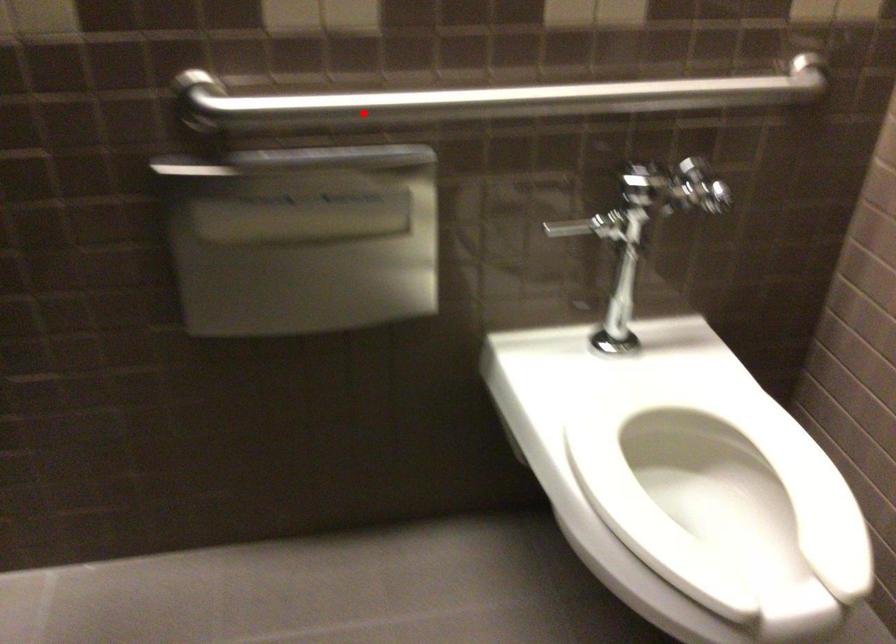
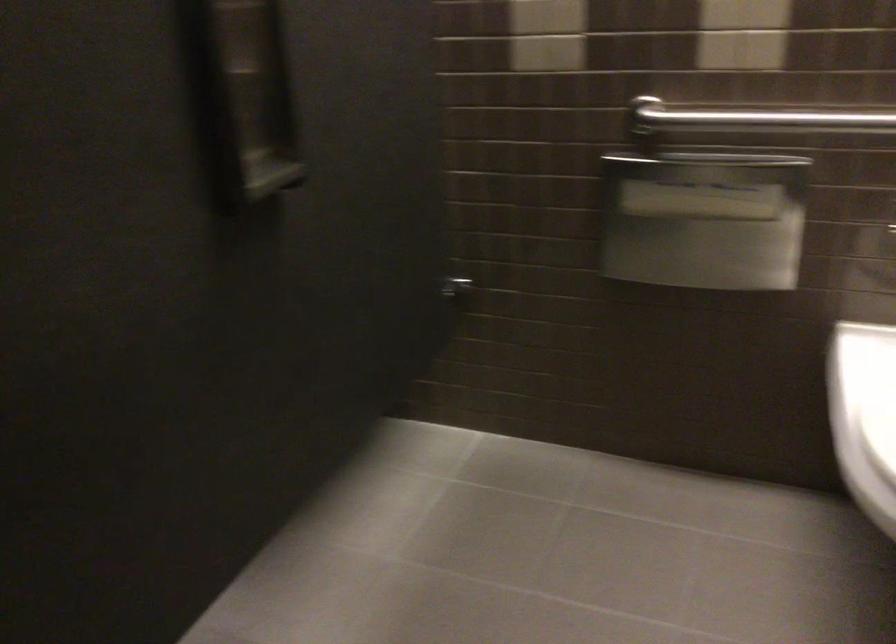
The point at the highlighted location is marked in the first image. Where is the corresponding point in the second image?

(751, 116)